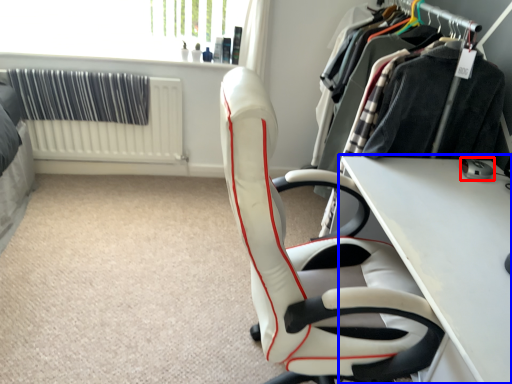
Question: Among these objects, which one is nearest to the camera, equipment (highlighted by a red box) or table (highlighted by a blue box)?

Choices:
 (A) equipment
 (B) table

Answer: (B)